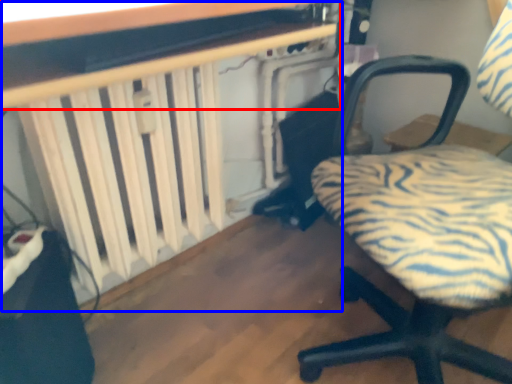
Question: Which object appears farthest to the camera in this image, table (highlighted by a red box) or table (highlighted by a blue box)?

Choices:
 (A) table
 (B) table

Answer: (B)